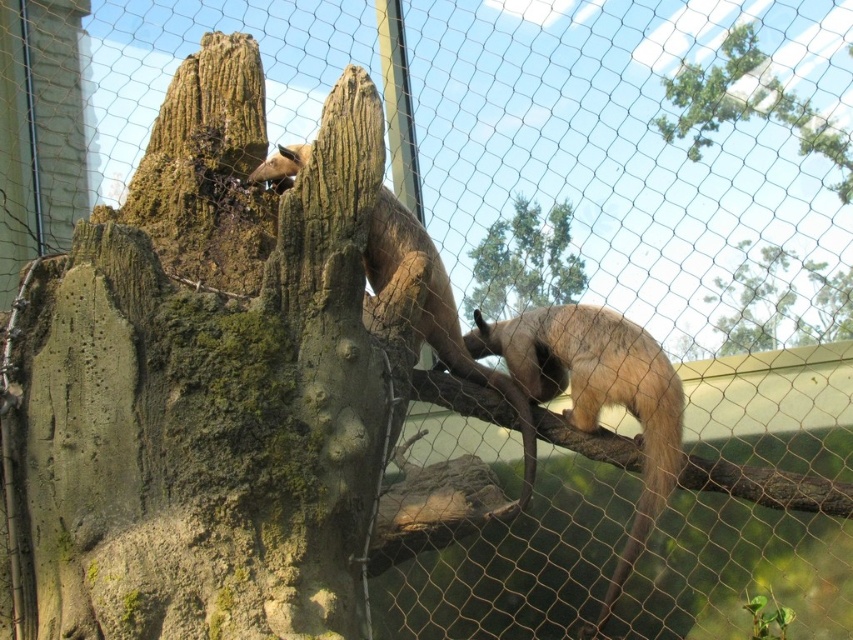
Between fuzzy brown anteater at center and light brown fur anteater at upper left, which one appears on the right side from the viewer's perspective?

fuzzy brown anteater at center is more to the right.

Who is taller, fuzzy brown anteater at center or light brown fur anteater at upper left?

light brown fur anteater at upper left

Measure the distance between point (650,436) and camera.

12.97 feet

What are the coordinates of `fuzzy brown anteater at center` in the screenshot? It's located at (596, 394).

Is point (126, 534) closer to viewer compared to point (291, 180)?

Yes.

Which is above, green mossy bark at upper left or light brown fur anteater at upper left?

green mossy bark at upper left is above.

Describe the element at coordinates (207, 381) in the screenshot. I see `green mossy bark at upper left` at that location.

Find the location of `green mossy bark at upper left`. green mossy bark at upper left is located at coordinates (207, 381).

Consider the image. Who is lower down, green mossy tree trunk at upper center or light brown fur anteater at upper left?

light brown fur anteater at upper left

Who is more forward, [814,314] or [524,484]?

Point [524,484]

Identify the location of green mossy tree trunk at upper center. This screenshot has width=853, height=640. (775, 304).